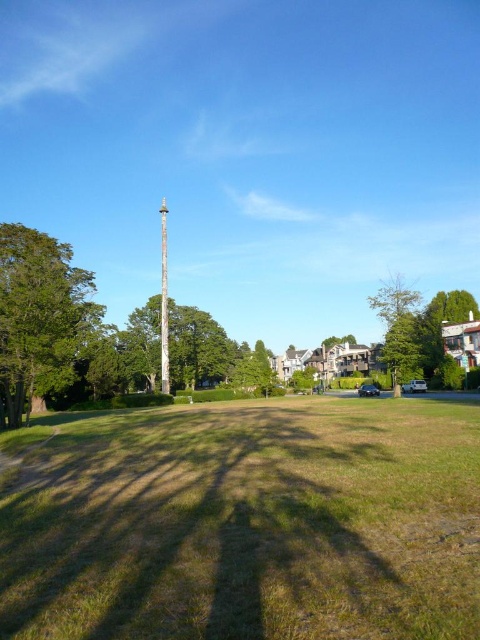
You are a gardener who needs to mow the lawn. You see the green grass at center and the smooth silver pole at center. Which object should you avoid cutting with the lawnmower?

You should avoid cutting the smooth silver pole at center because the green grass at center is in front of it, meaning the pole is behind the grass and not part of the lawn area to be mowed.

Looking at this image, you are standing in the outdoor scene described. You notice two points marked in the image. The first point is at coordinates point (9, 390) and the second is at point (383, 307). If you want to reach the point that is closer to you, which coordinate should you head towards?

You should head towards point (9, 390) because it is closer to the camera than point (383, 307).

You are a landscape architect designing a new garden layout. You need to place a decorative statue exactly at the center of the garden. However, there is already a smooth brown pole at center. Can you place the statue at the exact center without overlapping it?

The smooth brown pole at center is already located at the center of the garden, so placing the statue there would cause overlap. Choose a different location.